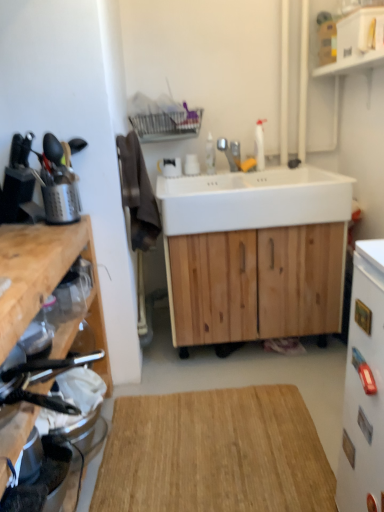
Question: From a real-world perspective, is white glossy refrigerator at right, the first appliance positioned from the right, beneath metallic silver toaster at left, which ranks as the fourth appliance in left-to-right order?

Choices:
 (A) yes
 (B) no

Answer: (B)

Question: Considering the relative sizes of white glossy refrigerator at right, which is the 5th appliance from left to right, and metallic silver toaster at left, which ranks as the fourth appliance in left-to-right order, in the image provided, is white glossy refrigerator at right, which is the 5th appliance from left to right, smaller than metallic silver toaster at left, which ranks as the fourth appliance in left-to-right order,?

Choices:
 (A) no
 (B) yes

Answer: (B)

Question: Is white glossy refrigerator at right, the first appliance positioned from the right, not inside metallic silver toaster at left, the second appliance viewed from the right?

Choices:
 (A) no
 (B) yes

Answer: (B)

Question: Is white glossy refrigerator at right, the first appliance positioned from the right, positioned behind metallic silver toaster at left, the second appliance viewed from the right?

Choices:
 (A) no
 (B) yes

Answer: (A)

Question: Is white glossy refrigerator at right, which is the 5th appliance from left to right, taller than metallic silver toaster at left, which ranks as the fourth appliance in left-to-right order?

Choices:
 (A) yes
 (B) no

Answer: (A)

Question: Is metallic silver toaster at left, which ranks as the fourth appliance in left-to-right order, to the left or to the right of brushed metal utensil holder at left, the 1th appliance viewed from the left, in the image?

Choices:
 (A) left
 (B) right

Answer: (B)

Question: In the image, is metallic silver toaster at left, the second appliance viewed from the right, positioned in front of or behind brushed metal utensil holder at left, the 1th appliance viewed from the left?

Choices:
 (A) behind
 (B) front

Answer: (B)

Question: From their relative heights in the image, would you say metallic silver toaster at left, which ranks as the fourth appliance in left-to-right order, is taller or shorter than brushed metal utensil holder at left, the 1th appliance viewed from the left?

Choices:
 (A) short
 (B) tall

Answer: (B)

Question: From a real-world perspective, is metallic silver toaster at left, the second appliance viewed from the right, positioned above or below brushed metal utensil holder at left, marked as the fifth appliance in a right-to-left arrangement?

Choices:
 (A) above
 (B) below

Answer: (B)

Question: Considering the relative positions of natural wood cutting board at center and white glossy refrigerator at right, the first appliance positioned from the right, in the image provided, is natural wood cutting board at center to the left or to the right of white glossy refrigerator at right, the first appliance positioned from the right,?

Choices:
 (A) left
 (B) right

Answer: (A)

Question: From a real-world perspective, relative to white glossy refrigerator at right, the first appliance positioned from the right, is natural wood cutting board at center vertically above or below?

Choices:
 (A) above
 (B) below

Answer: (B)

Question: Considering the positions of natural wood cutting board at center and white glossy refrigerator at right, the first appliance positioned from the right, in the image, is natural wood cutting board at center wider or thinner than white glossy refrigerator at right, the first appliance positioned from the right,?

Choices:
 (A) thin
 (B) wide

Answer: (B)

Question: Is natural wood cutting board at center bigger or smaller than white glossy refrigerator at right, the first appliance positioned from the right?

Choices:
 (A) big
 (B) small

Answer: (B)

Question: Is metallic silver utensil holder at left, the 4th appliance in the right-to-left sequence, spatially inside white glossy refrigerator at right, which is the 5th appliance from left to right, or outside of it?

Choices:
 (A) inside
 (B) outside

Answer: (B)

Question: In the image, is metallic silver utensil holder at left, the 4th appliance in the right-to-left sequence, positioned in front of or behind white glossy refrigerator at right, the first appliance positioned from the right?

Choices:
 (A) front
 (B) behind

Answer: (B)